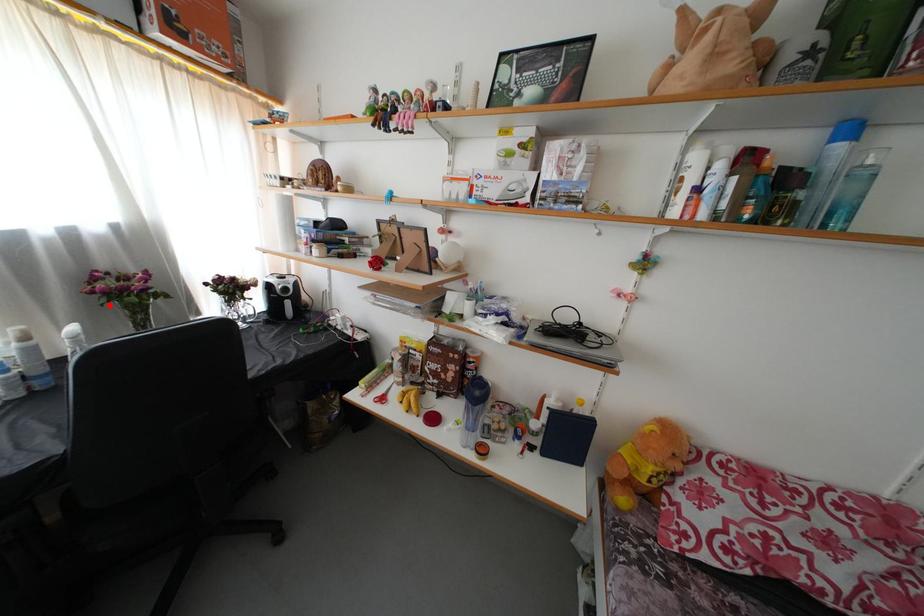
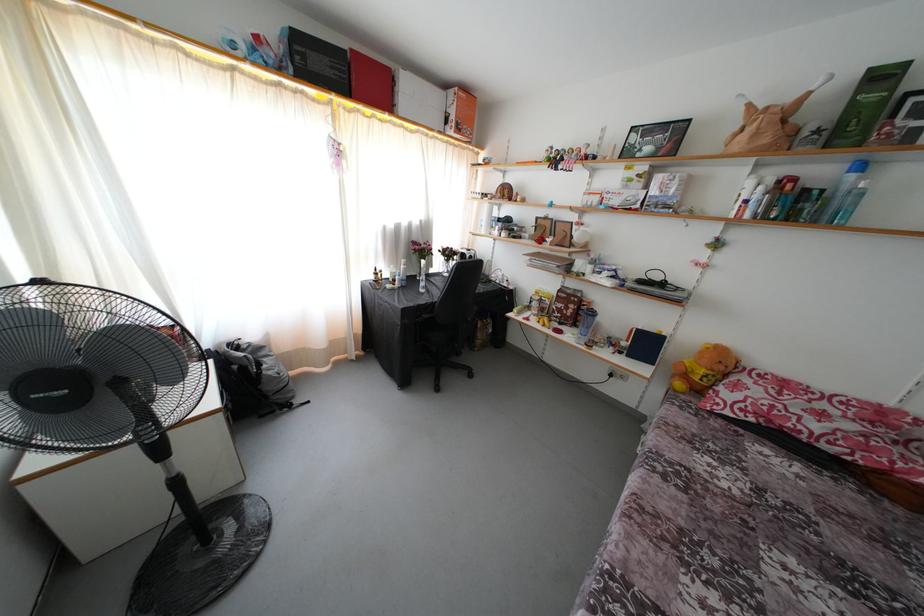
Locate, in the second image, the point that corresponds to the highlighted location in the first image.

(422, 259)